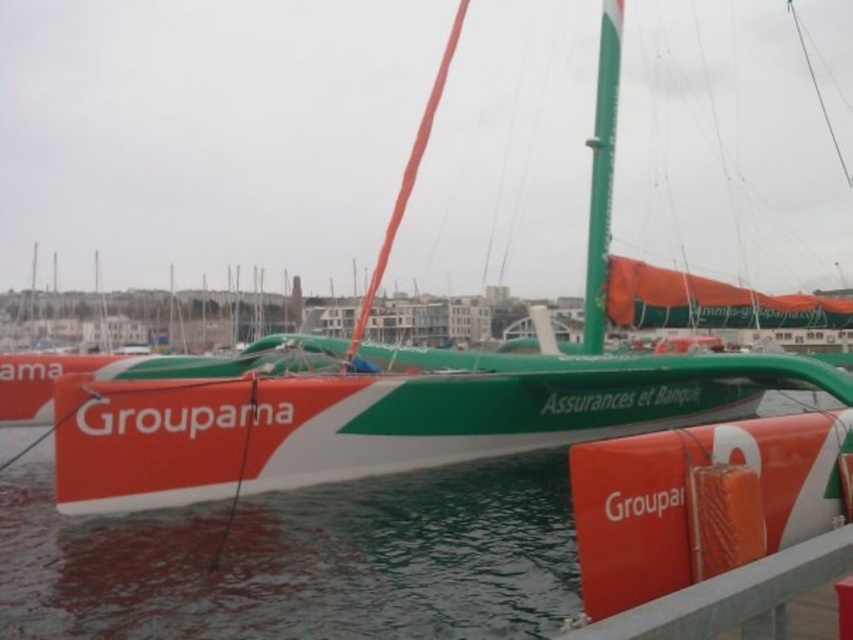
Question: Can you confirm if green matte water at center is positioned to the right of orange matte rail at lower right?

Choices:
 (A) no
 (B) yes

Answer: (A)

Question: Which point is closer to the camera taking this photo?

Choices:
 (A) (19, 515)
 (B) (767, 561)

Answer: (B)

Question: Among these objects, which one is farthest from the camera?

Choices:
 (A) orange matte rail at lower right
 (B) green matte water at center

Answer: (B)

Question: Is green matte water at center positioned in front of orange matte rail at lower right?

Choices:
 (A) yes
 (B) no

Answer: (B)

Question: Is green matte water at center positioned in front of orange matte rail at lower right?

Choices:
 (A) yes
 (B) no

Answer: (B)